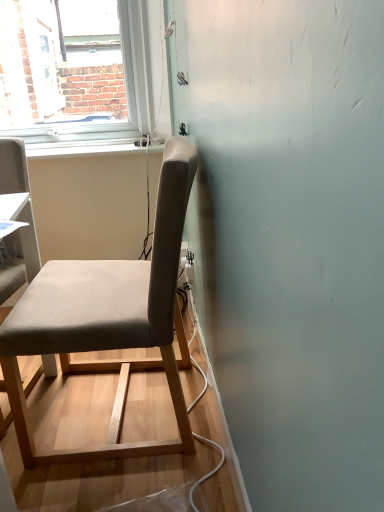
Locate an element on the screen. matte gray fabric chair at center is located at coordinates (109, 317).

Image resolution: width=384 pixels, height=512 pixels. What do you see at coordinates (109, 317) in the screenshot? I see `matte gray fabric chair at center` at bounding box center [109, 317].

Where is `matte gray fabric chair at center`? The image size is (384, 512). matte gray fabric chair at center is located at coordinates (109, 317).